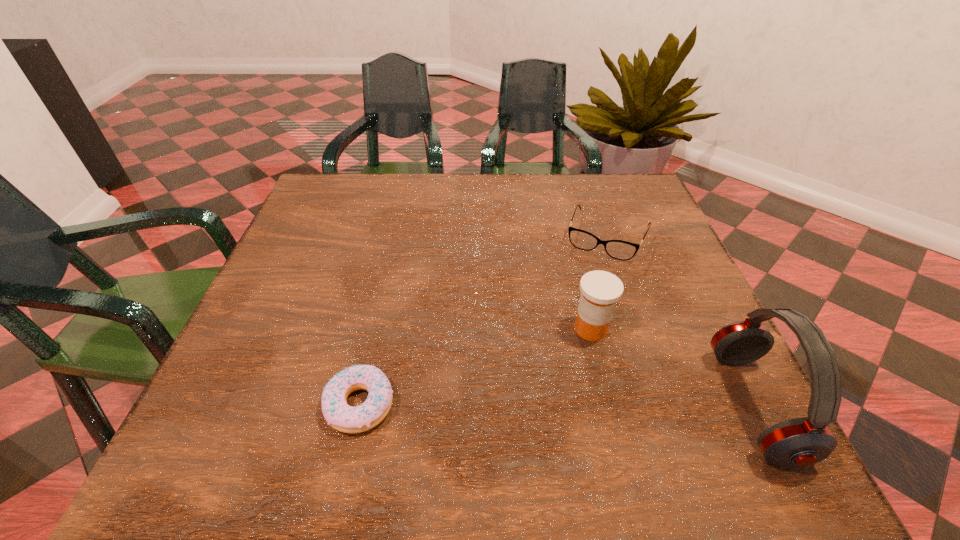
The image size is (960, 540). What are the coordinates of `vacant space on the desktop that is between the doughnut and the rightmost object and is positioned on the front-facing side of the farthest object` in the screenshot? It's located at (538, 404).

Where is `free spot on the desktop that is between the doughnut and the rightmost object and is positioned on the label of the third nearest object`? The image size is (960, 540). free spot on the desktop that is between the doughnut and the rightmost object and is positioned on the label of the third nearest object is located at coordinates (545, 405).